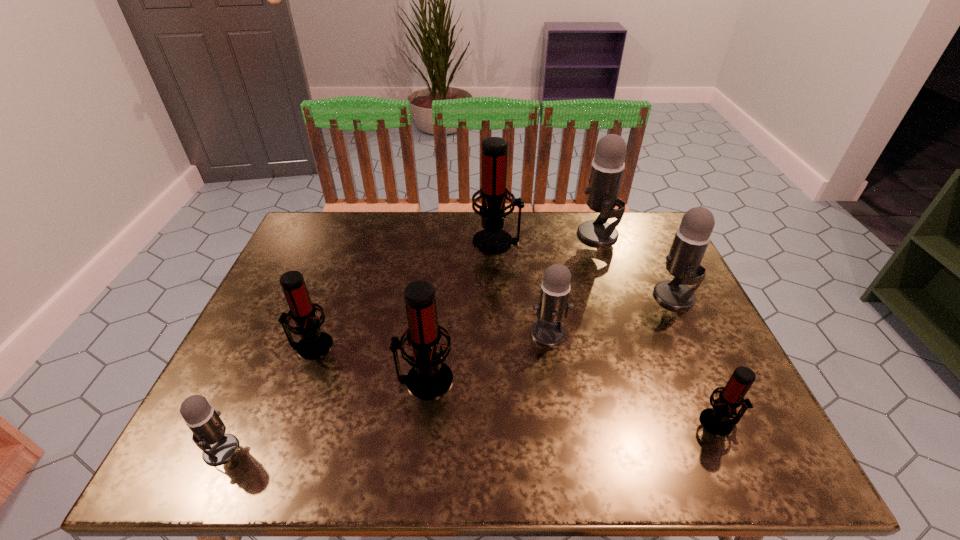
Where is `the third biggest gray microphone`? This screenshot has height=540, width=960. the third biggest gray microphone is located at coordinates 553,307.

Identify the location of the third gray microphone from right to left. The image size is (960, 540). (553, 307).

This screenshot has width=960, height=540. I want to click on the rightmost red microphone, so pos(719,420).

Where is `the nearest red microphone`? the nearest red microphone is located at coordinates (719, 420).

Where is `the smallest gray microphone`? The width and height of the screenshot is (960, 540). the smallest gray microphone is located at coordinates (208, 429).

Locate an element on the screen. the nearest gray microphone is located at coordinates (x=208, y=429).

Identify the location of vacant space situated 0.200m on the front of the biggest red microphone. The width and height of the screenshot is (960, 540). (500, 300).

This screenshot has width=960, height=540. In order to click on vacant position located 0.400m on the left of the third gray microphone from left to right in this screenshot , I will do `click(450, 234)`.

Identify the location of vacant space located 0.130m on the left of the sixth nearest microphone. (605, 296).

At what (x,y) coordinates should I click in order to perform the action: click on vacant point located on the front of the second red microphone from left to right. Please return your answer as a coordinate pair (x, y). Looking at the image, I should click on (420, 421).